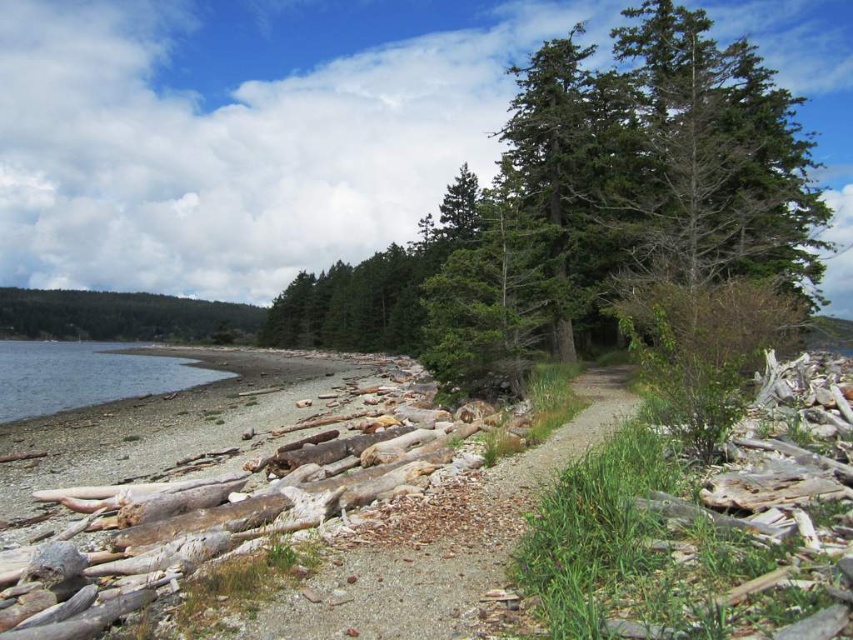
You are standing at the shoreline and want to take a photo of the green textured tree at upper center. If your camera can focus up to 25 meters, will it be able to capture the tree clearly?

The green textured tree at upper center is 23.48 meters away from the camera, which is within the camera focus range of 25 meters. Therefore, the camera can capture the tree clearly.

You are standing at the shoreline on the left side of the image. Looking towards the center, can you see the green textured tree at upper center?

Yes, the green textured tree at upper center is positioned at point (589, 208), which is within the line of sight from the shoreline on the left side.